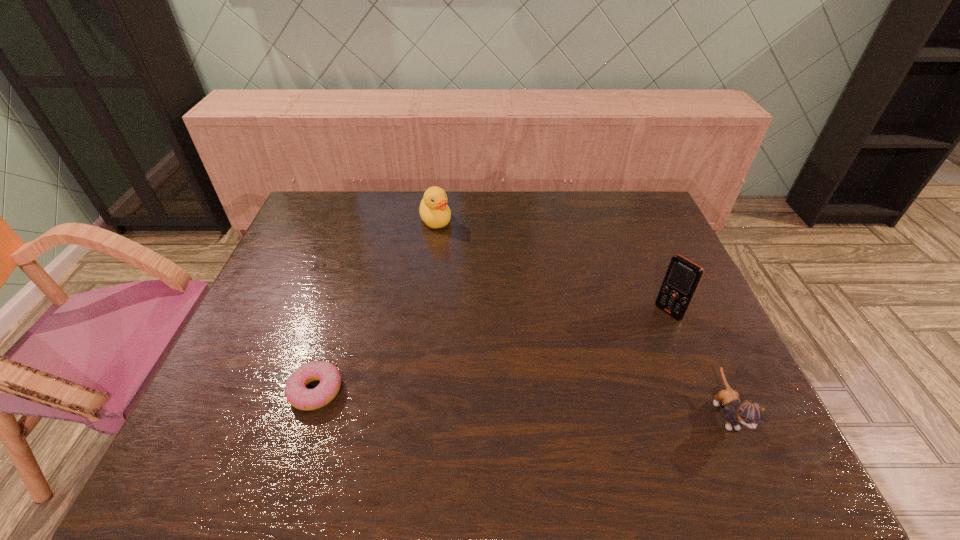
Where is `vacant space located 0.390m at the beak of the second tallest object`? The height and width of the screenshot is (540, 960). vacant space located 0.390m at the beak of the second tallest object is located at coordinates (478, 316).

Where is `vacant space located on the screen of the cellular telephone`? This screenshot has width=960, height=540. vacant space located on the screen of the cellular telephone is located at coordinates (589, 378).

The height and width of the screenshot is (540, 960). In order to click on vacant position located 0.380m on the screen of the cellular telephone in this screenshot , I will do `click(563, 400)`.

You are a GUI agent. You are given a task and a screenshot of the screen. Output one action in this format:
    pyautogui.click(x=<x>, y=<y>)
    Task: Click on the vacant space positioned on the screen of the cellular telephone
    The height and width of the screenshot is (540, 960).
    Given the screenshot: What is the action you would take?
    pyautogui.click(x=595, y=373)

Where is `object at the far edge`? object at the far edge is located at coordinates (434, 211).

Where is `doughnut at the near edge`? doughnut at the near edge is located at coordinates (297, 394).

You are a GUI agent. You are given a task and a screenshot of the screen. Output one action in this format:
    pyautogui.click(x=<x>, y=<y>)
    Task: Click on the kitten that is at the near edge
    Image resolution: width=960 pixels, height=540 pixels.
    Given the screenshot: What is the action you would take?
    pyautogui.click(x=747, y=412)

Find the location of a particular element. kitten located in the right edge section of the desktop is located at coordinates (747, 412).

This screenshot has width=960, height=540. Identify the location of cellular telephone present at the right edge. (683, 276).

Where is `object that is at the near right corner`? object that is at the near right corner is located at coordinates (747, 412).